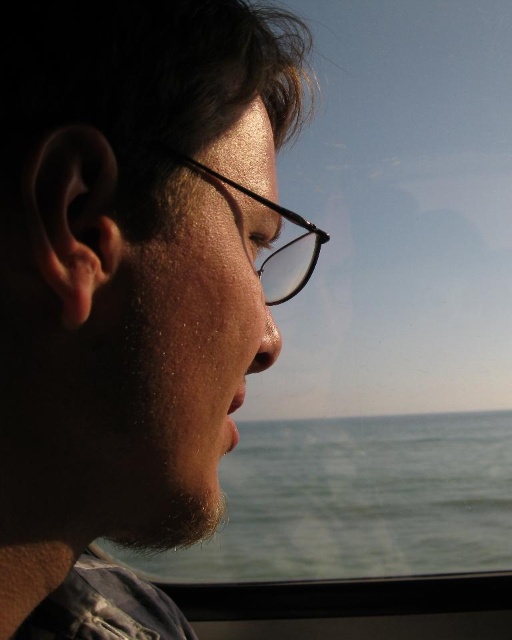
Is point (153, 593) positioned in front of point (380, 490)?

Yes, it is in front of point (380, 490).

Describe the element at coordinates (132, 285) in the screenshot. This screenshot has height=640, width=512. I see `matte black glasses at center` at that location.

In order to click on matte black glasses at center in this screenshot , I will do `click(132, 285)`.

I want to click on matte black glasses at center, so coord(132,285).

Locate an element on the screen. The width and height of the screenshot is (512, 640). olive green water at lower center is located at coordinates (354, 500).

Where is `olive green water at lower center`? olive green water at lower center is located at coordinates (354, 500).

Between matte black glasses at center and black plastic glasses at center, which one has more height?

Standing taller between the two is matte black glasses at center.

Is matte black glasses at center below black plastic glasses at center?

Correct, matte black glasses at center is located below black plastic glasses at center.

Is point (46, 83) positioned after point (285, 262)?

No.

Where is `matte black glasses at center`? matte black glasses at center is located at coordinates (132, 285).